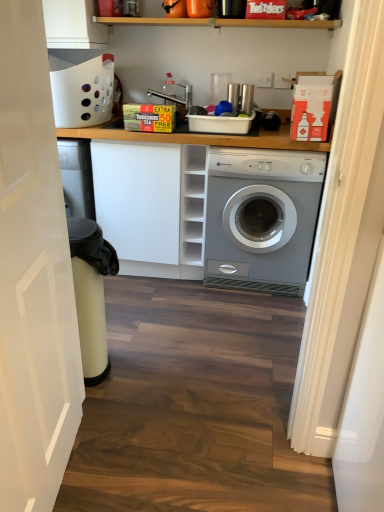
Question: Is silver metallic washing machine at center-right thinner than white matte cabinet at center?

Choices:
 (A) no
 (B) yes

Answer: (A)

Question: Considering the relative sizes of silver metallic washing machine at center-right and white matte cabinet at center in the image provided, is silver metallic washing machine at center-right taller than white matte cabinet at center?

Choices:
 (A) no
 (B) yes

Answer: (A)

Question: Does silver metallic washing machine at center-right have a smaller size compared to white matte cabinet at center?

Choices:
 (A) no
 (B) yes

Answer: (A)

Question: From the image's perspective, is silver metallic washing machine at center-right on white matte cabinet at center?

Choices:
 (A) no
 (B) yes

Answer: (A)

Question: From a real-world perspective, does silver metallic washing machine at center-right stand above white matte cabinet at center?

Choices:
 (A) no
 (B) yes

Answer: (B)

Question: Considering the positions of white matte door at left and white matte cabinet at center in the image, is white matte door at left wider or thinner than white matte cabinet at center?

Choices:
 (A) thin
 (B) wide

Answer: (A)

Question: From the image's perspective, relative to white matte cabinet at center, is white matte door at left above or below?

Choices:
 (A) above
 (B) below

Answer: (B)

Question: Would you say white matte door at left is to the left or to the right of white matte cabinet at center in the picture?

Choices:
 (A) left
 (B) right

Answer: (A)

Question: Relative to white matte cabinet at center, is white matte door at left in front or behind?

Choices:
 (A) front
 (B) behind

Answer: (A)

Question: In terms of size, does silver metallic washing machine at center-right appear bigger or smaller than white matte door at left?

Choices:
 (A) big
 (B) small

Answer: (A)

Question: In terms of width, does silver metallic washing machine at center-right look wider or thinner when compared to white matte door at left?

Choices:
 (A) wide
 (B) thin

Answer: (A)

Question: Is point (x=254, y=177) positioned closer to the camera than point (x=44, y=120)?

Choices:
 (A) farther
 (B) closer

Answer: (A)

Question: From the image's perspective, is silver metallic washing machine at center-right above or below white matte door at left?

Choices:
 (A) above
 (B) below

Answer: (A)

Question: Looking at their shapes, would you say white matte door at left is wider or thinner than silver metallic washing machine at center-right?

Choices:
 (A) wide
 (B) thin

Answer: (B)

Question: Considering the positions of white matte door at left and silver metallic washing machine at center-right in the image, is white matte door at left taller or shorter than silver metallic washing machine at center-right?

Choices:
 (A) tall
 (B) short

Answer: (A)